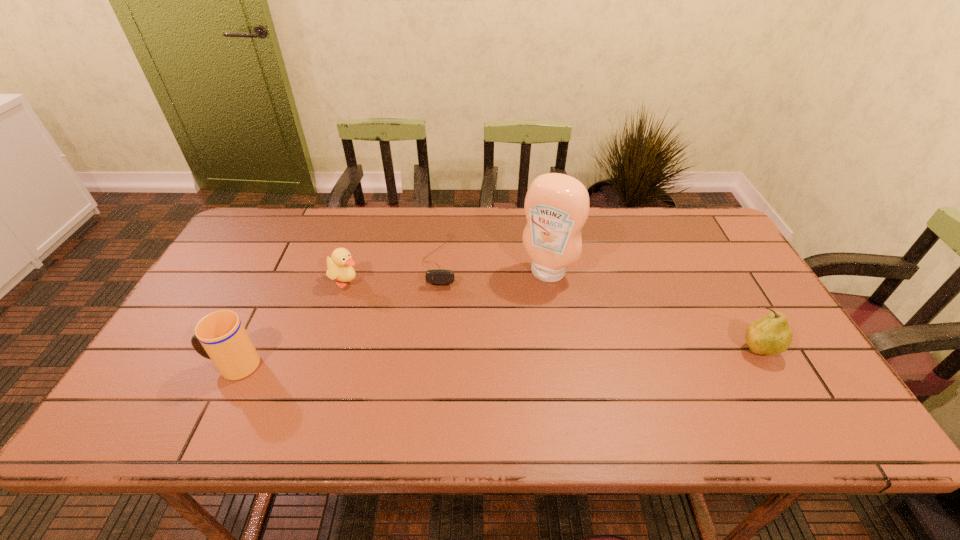
Find the location of a particular element. This screenshot has width=960, height=540. vacant region between the fourth object from right to left and the cup is located at coordinates (290, 323).

Locate an element on the screen. The height and width of the screenshot is (540, 960). empty space that is in between the third object from right to left and the duckling is located at coordinates (394, 271).

Find the location of a particular element. Image resolution: width=960 pixels, height=540 pixels. vacant region between the second object from left to right and the webcam is located at coordinates (394, 271).

You are a GUI agent. You are given a task and a screenshot of the screen. Output one action in this format:
    pyautogui.click(x=<x>, y=<y>)
    Task: Click on the vacant area that lies between the duckling and the leftmost object
    
    Given the screenshot: What is the action you would take?
    pyautogui.click(x=290, y=323)

In order to click on unoccupied area between the pear and the duckling in this screenshot , I will do (x=553, y=315).

Locate an element on the screen. free space between the shortest object and the condiment is located at coordinates (493, 267).

The height and width of the screenshot is (540, 960). Identify the location of free space between the duckling and the leftmost object. (290, 323).

Select which object is the closest to the duckling. Please provide its 2D coordinates. Your answer should be formatted as a tuple, i.e. [(x, y)], where the tuple contains the x and y coordinates of a point satisfying the conditions above.

[(438, 276)]

Point out which object is positioned as the fourth nearest to the tallest object. Please provide its 2D coordinates. Your answer should be formatted as a tuple, i.e. [(x, y)], where the tuple contains the x and y coordinates of a point satisfying the conditions above.

[(220, 336)]

Locate an element on the screen. vacant region that satisfies the following two spatial constraints: 1. on the front side of the rightmost object; 2. on the right side of the fourth object from right to left is located at coordinates (324, 350).